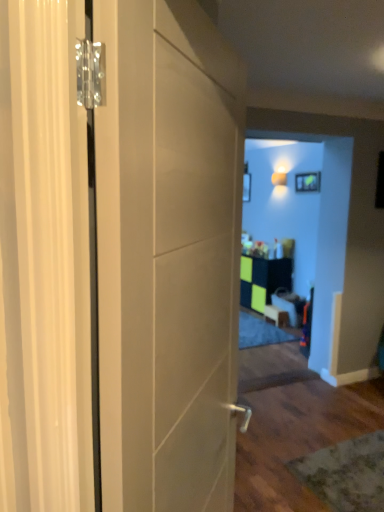
Question: Should I look upward or downward to see matte green picture frame at upper center?

Choices:
 (A) down
 (B) up

Answer: (B)

Question: Is green matte cabinet at center beside matte white door at left?

Choices:
 (A) yes
 (B) no

Answer: (B)

Question: Is green matte cabinet at center taller than matte white door at left?

Choices:
 (A) yes
 (B) no

Answer: (B)

Question: Is green matte cabinet at center behind matte white door at left?

Choices:
 (A) yes
 (B) no

Answer: (A)

Question: Would you say matte white door at left is part of green matte cabinet at center's contents?

Choices:
 (A) yes
 (B) no

Answer: (B)

Question: Is green matte cabinet at center turned away from matte white door at left?

Choices:
 (A) no
 (B) yes

Answer: (A)

Question: Can we say green matte cabinet at center lies outside matte white door at left?

Choices:
 (A) no
 (B) yes

Answer: (B)

Question: Does matte black cabinet at center, which appears as the 2th furniture when viewed from the right, have a lesser height compared to wooden table at center, the 1th furniture viewed from the right?

Choices:
 (A) yes
 (B) no

Answer: (A)

Question: Is matte black cabinet at center, which appears as the 2th furniture when viewed from the right, positioned beyond the bounds of wooden table at center, which ranks as the second furniture in left-to-right order?

Choices:
 (A) yes
 (B) no

Answer: (A)

Question: Does matte black cabinet at center, which appears as the 2th furniture when viewed from the right, have a smaller size compared to wooden table at center, the 1th furniture viewed from the right?

Choices:
 (A) yes
 (B) no

Answer: (A)

Question: Considering the relative sizes of matte black cabinet at center, which appears as the 2th furniture when viewed from the right, and wooden table at center, which ranks as the second furniture in left-to-right order, in the image provided, is matte black cabinet at center, which appears as the 2th furniture when viewed from the right, thinner than wooden table at center, which ranks as the second furniture in left-to-right order,?

Choices:
 (A) no
 (B) yes

Answer: (B)

Question: From the image's perspective, is matte black cabinet at center, which appears as the 2th furniture when viewed from the right, beneath wooden table at center, which ranks as the second furniture in left-to-right order?

Choices:
 (A) yes
 (B) no

Answer: (A)

Question: Considering the relative positions of matte black cabinet at center, which is the first furniture in left-to-right order, and wooden table at center, the 1th furniture viewed from the right, in the image provided, is matte black cabinet at center, which is the first furniture in left-to-right order, to the left of wooden table at center, the 1th furniture viewed from the right, from the viewer's perspective?

Choices:
 (A) no
 (B) yes

Answer: (B)

Question: Is green matte cabinet at center to the right of matte green picture frame at upper center from the viewer's perspective?

Choices:
 (A) yes
 (B) no

Answer: (B)